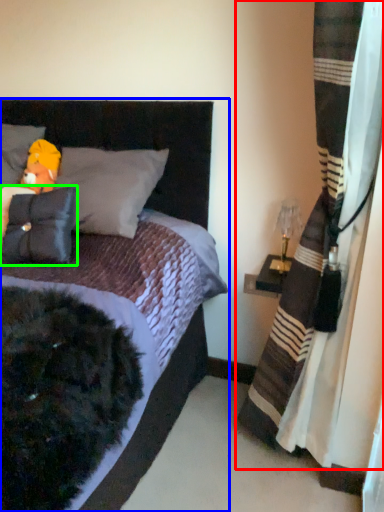
Question: Based on their relative distances, which object is nearer to curtain (highlighted by a red box)? Choose from bed (highlighted by a blue box) and pillow (highlighted by a green box).

Choices:
 (A) bed
 (B) pillow

Answer: (A)